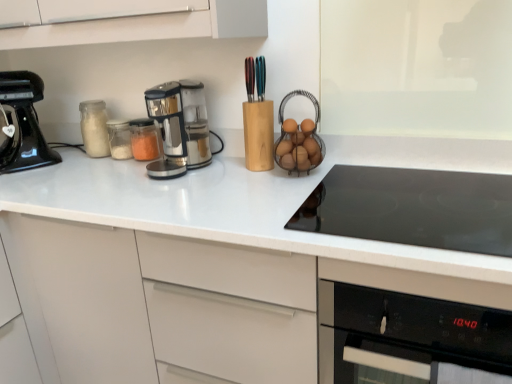
At what (x,y) coordinates should I click in order to perform the action: click on free location above black glass cooktop at center (from a real-world perspective). Please return your answer as a coordinate pair (x, y). Looking at the image, I should click on (428, 200).